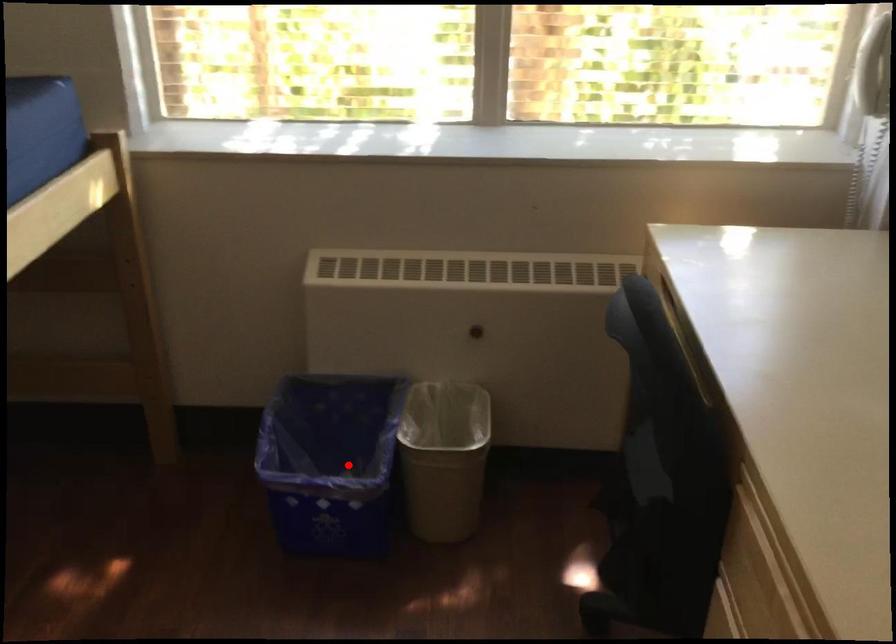
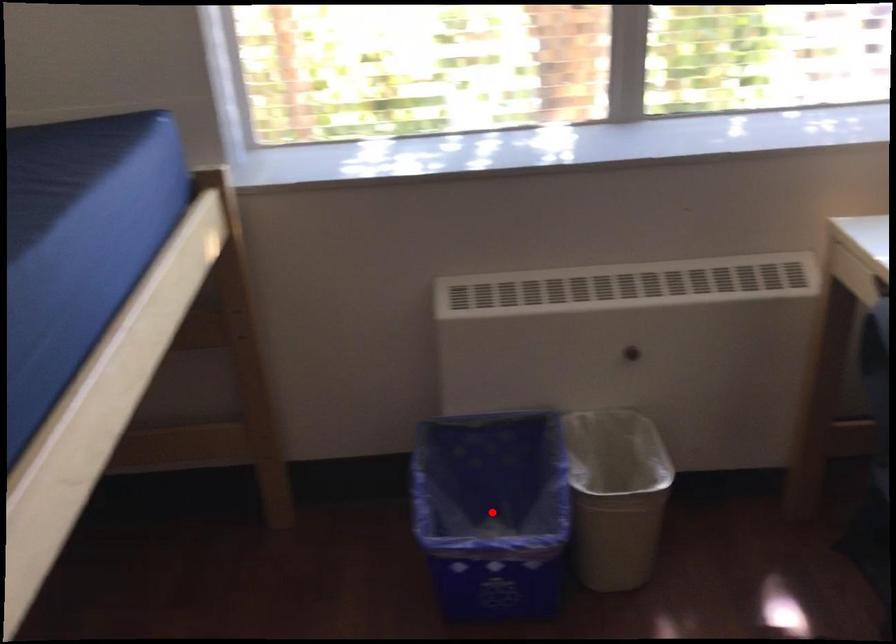
I am providing you with two images of the same scene from different viewpoints. A red point is marked on the first image and another point is marked on the second image. Do the highlighted points in image1 and image2 indicate the same real-world spot?

Yes